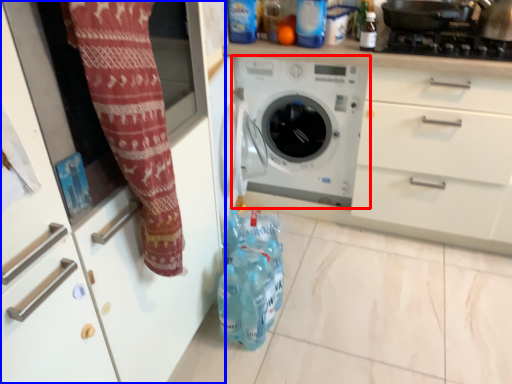
Question: Which point is further to the camera, washing machine (highlighted by a red box) or cabinetry (highlighted by a blue box)?

Choices:
 (A) washing machine
 (B) cabinetry

Answer: (A)